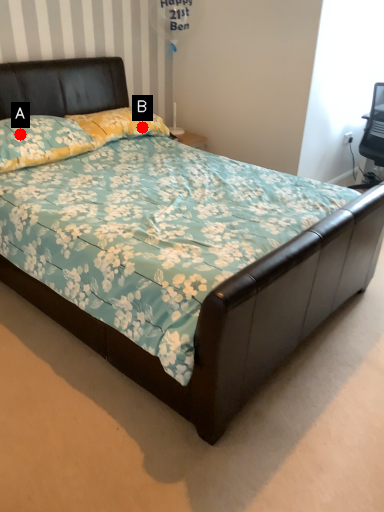
Question: Two points are circled on the image, labeled by A and B beside each circle. Which point is closer to the camera taking this photo?

Choices:
 (A) A is closer
 (B) B is closer

Answer: (A)